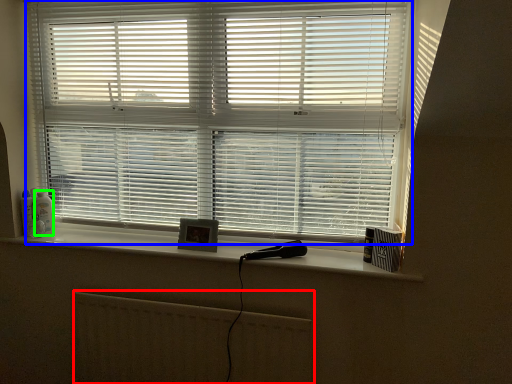
Question: Which object is positioned closest to radiator (highlighted by a red box)? Select from window blind (highlighted by a blue box) and toiletry (highlighted by a green box).

Choices:
 (A) window blind
 (B) toiletry

Answer: (A)